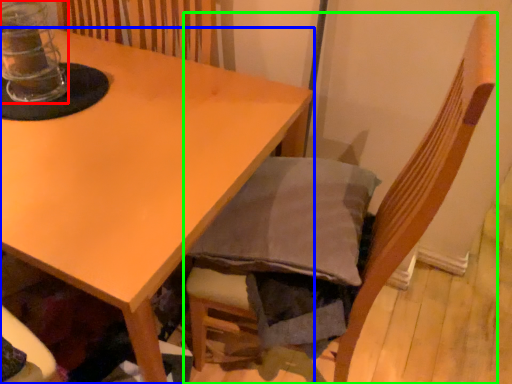
Question: Based on their relative distances, which object is farther from glass jar (highlighted by a red box)? Choose from table (highlighted by a blue box) and chair (highlighted by a green box).

Choices:
 (A) table
 (B) chair

Answer: (B)